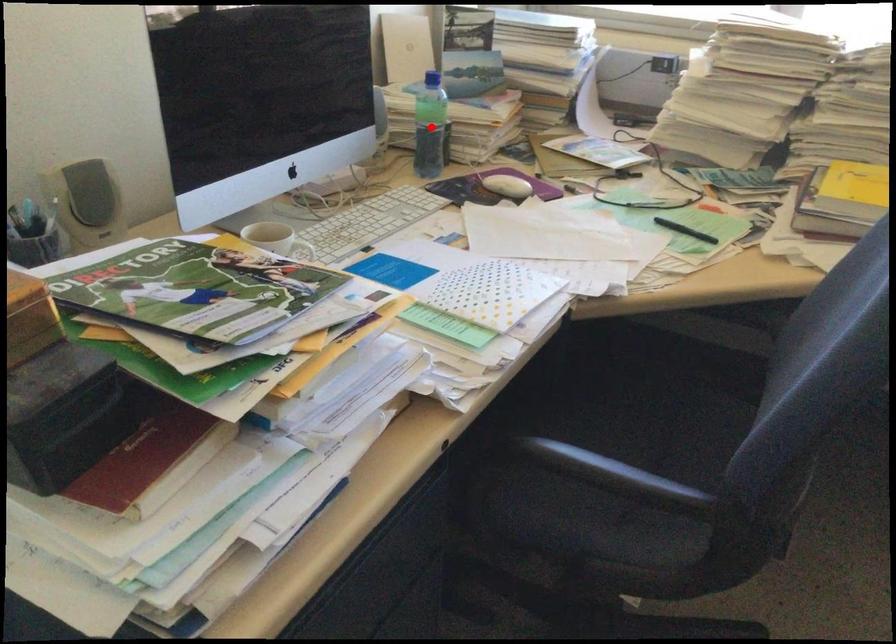
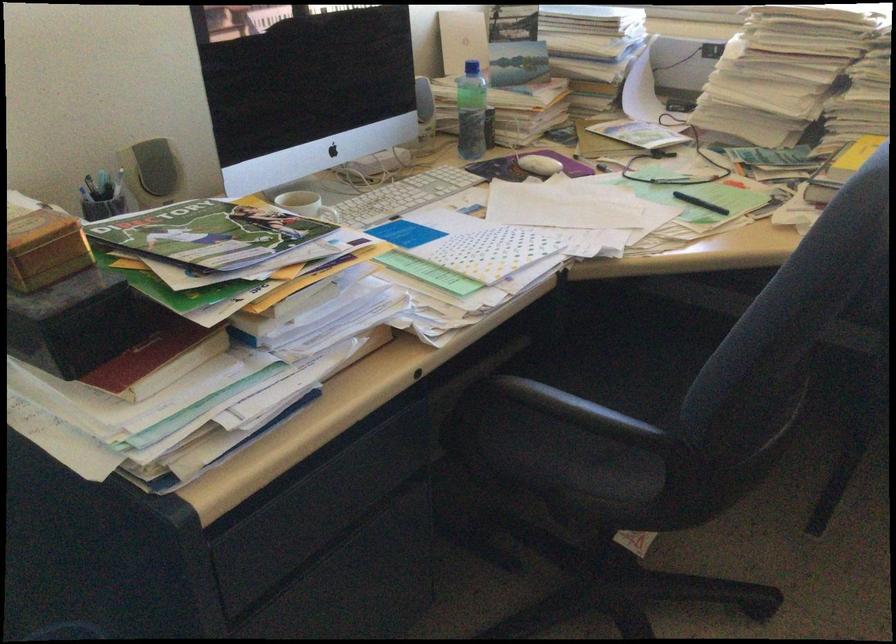
Where in the second image is the point corresponding to the highlighted location from the first image?

(470, 111)